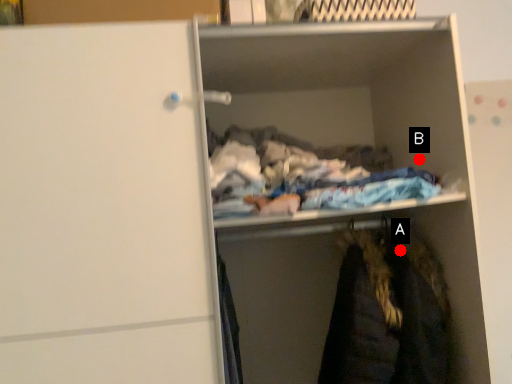
Question: Two points are circled on the image, labeled by A and B beside each circle. Which point is closer to the camera?

Choices:
 (A) A is closer
 (B) B is closer

Answer: (A)